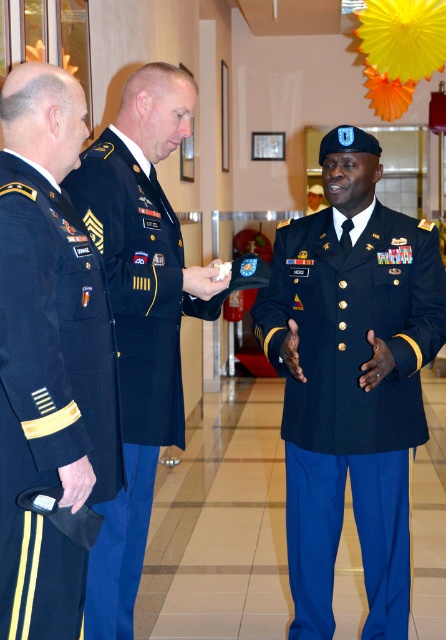
You are a photographer preparing to take a group photo of the navy blue uniform at center and the navy blue fabric uniform at center. Which of the two should you position closer to the camera to ensure both appear equally sized in the photo?

You should position the navy blue fabric uniform at center closer to the camera because the navy blue uniform at center is wider, so moving the narrower one forward will balance their apparent sizes.